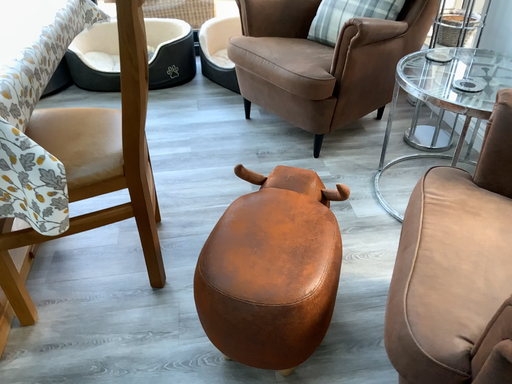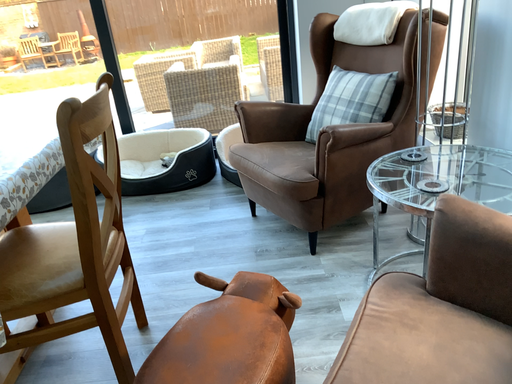
Question: How did the camera likely rotate when shooting the video?

Choices:
 (A) rotated right
 (B) rotated left

Answer: (B)